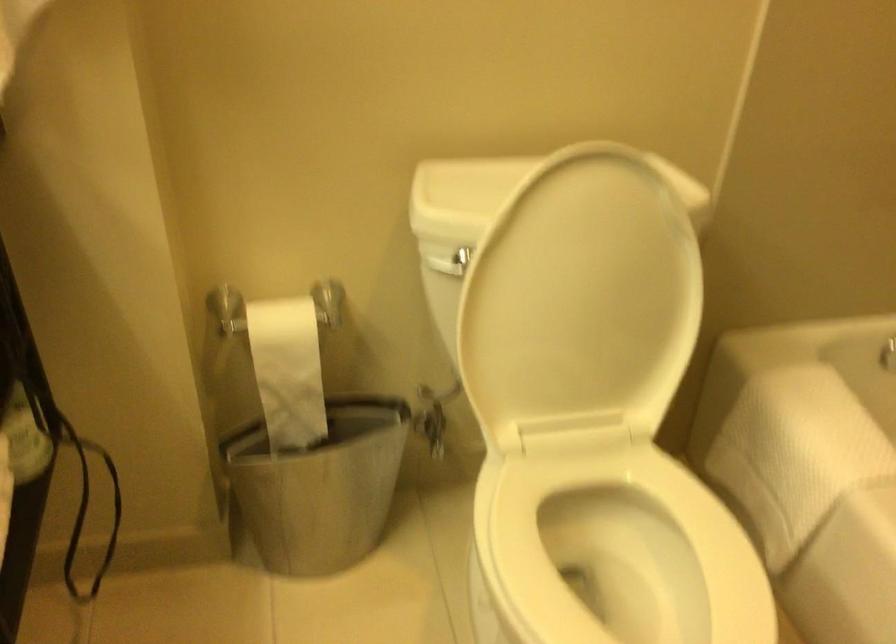
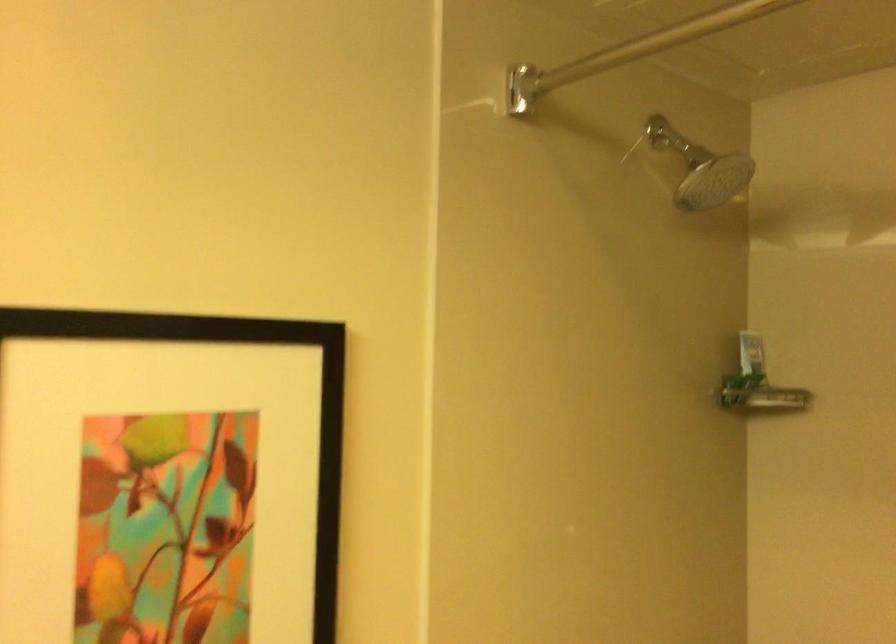
Looking at this image, based on the continuous images, in which direction is the camera rotating?

The rotation direction of the camera is right-up.